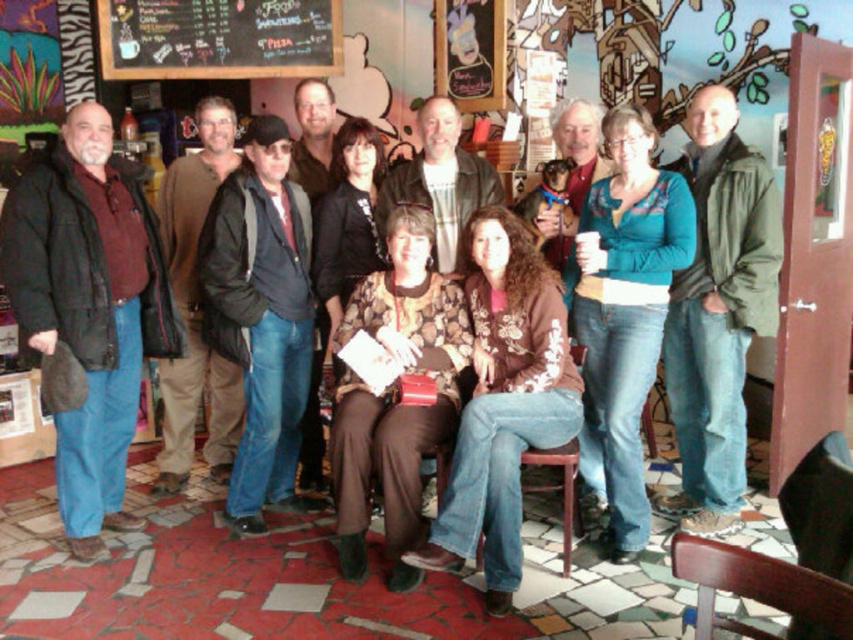
You are a person with a height of 1.6 meters standing at the entrance of the room. You want to read the black chalkboard menu at upper center. Can you see the entire menu without needing to move closer?

The black chalkboard menu at upper center is 3.99 meters away from the viewer. Since the viewer is 1.6 meters tall, they can likely see the entire menu from that distance, as the menu is positioned at upper center and the distance is within a typical comfortable viewing range for such a height.

You are at a restaurant and want to order food. You see the black chalkboard menu at upper center and the brown leather jacket at center. Which object is closer to the left side of the room?

The black chalkboard menu at upper center is closer to the left side of the room because it is positioned to the left of the brown leather jacket at center.